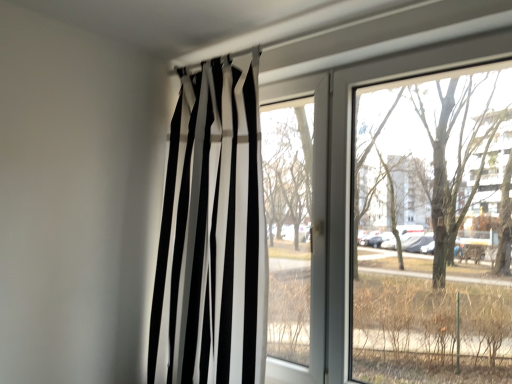
In order to click on black/white striped curtain at center in this screenshot , I will do `click(212, 235)`.

What do you see at coordinates (212, 235) in the screenshot? This screenshot has height=384, width=512. I see `black/white striped curtain at center` at bounding box center [212, 235].

In order to face black/white striped curtain at center, should I rotate leftwards or rightwards?

To align with it, rotate left about 6.066°.

Identify the location of black/white striped curtain at center. Image resolution: width=512 pixels, height=384 pixels. (212, 235).